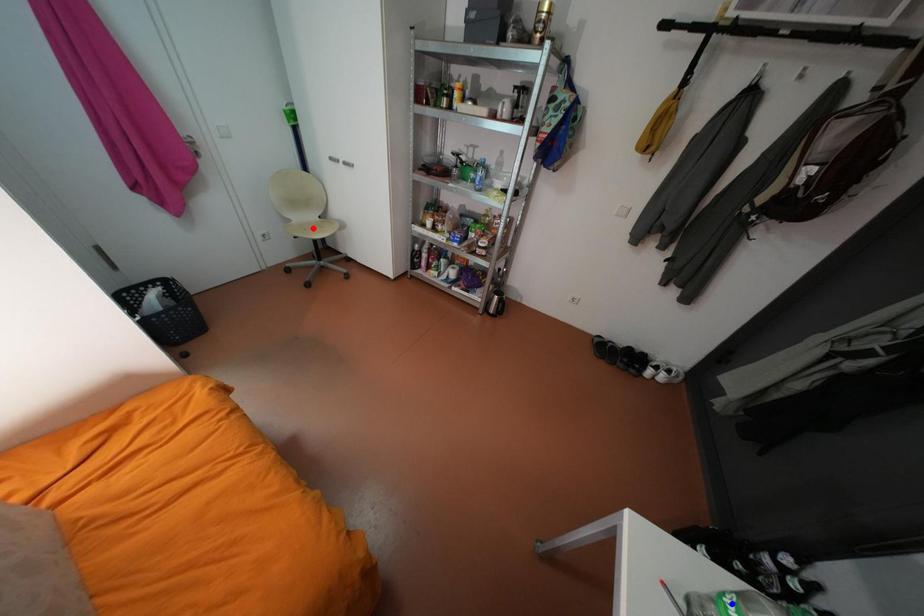
Question: Two points are marked on the image. Which point is closer to the camera?

Choices:
 (A) Blue point is closer.
 (B) Red point is closer.

Answer: (A)